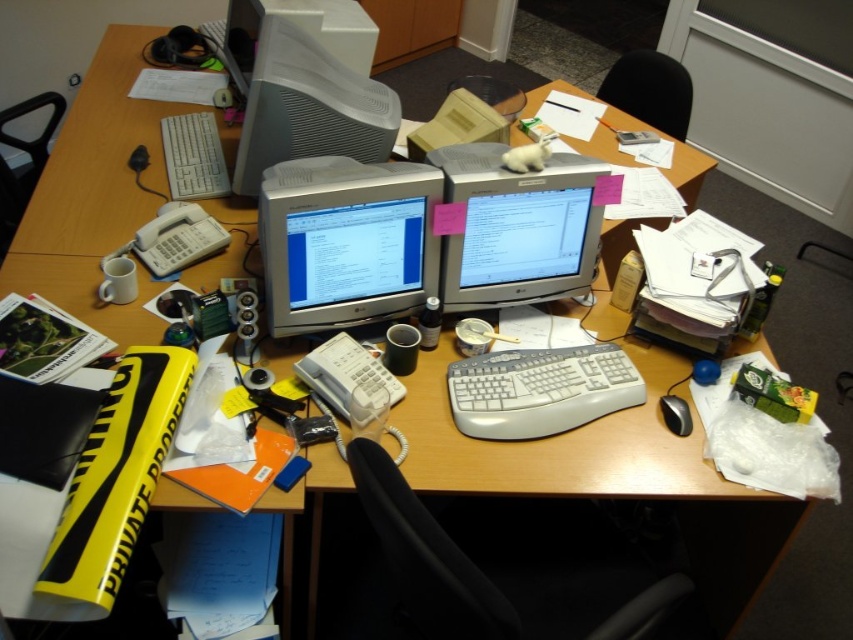
Question: Is white plastic monitor at upper center behind white plastic keyboard at upper left?

Choices:
 (A) no
 (B) yes

Answer: (A)

Question: Observing the image, what is the correct spatial positioning of white plastic keyboard at center in reference to white plastic monitor at upper center?

Choices:
 (A) above
 (B) below

Answer: (B)

Question: Among these objects, which one is nearest to the camera?

Choices:
 (A) black plastic mouse at lower right
 (B) white plastic keyboard at center
 (C) white plastic keyboard at upper left

Answer: (B)

Question: Among these objects, which one is nearest to the camera?

Choices:
 (A) white plastic keyboard at upper left
 (B) matte silver monitor at center
 (C) matte gray monitor at center

Answer: (B)

Question: Is white plastic keyboard at center above black plastic mouse at lower right?

Choices:
 (A) yes
 (B) no

Answer: (A)

Question: Estimate the real-world distances between objects in this image. Which object is closer to the white plastic keyboard at center?

Choices:
 (A) matte gray monitor at center
 (B) black plastic mouse at lower right
 (C) white plastic keyboard at upper left
 (D) satin silver monitor at center

Answer: (B)